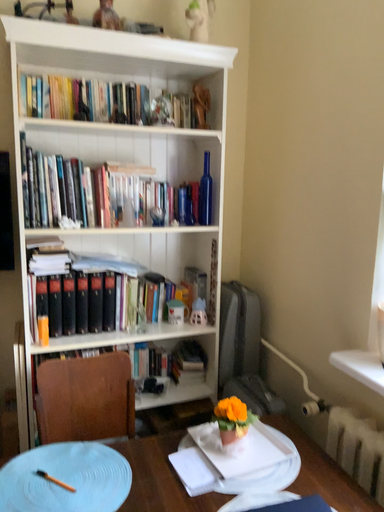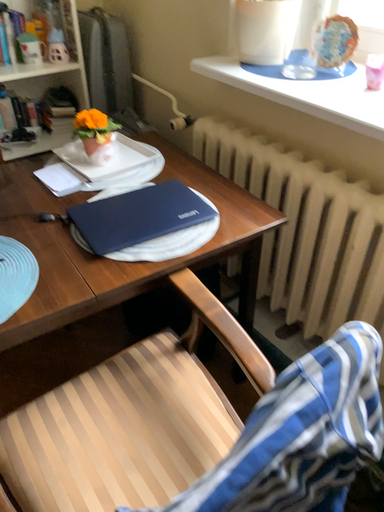
Question: How did the camera likely rotate when shooting the video?

Choices:
 (A) rotated upward
 (B) rotated downward

Answer: (B)